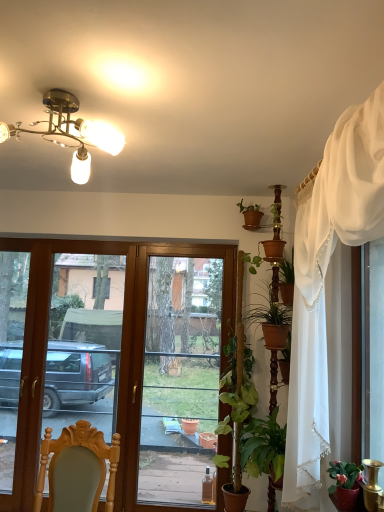
This screenshot has height=512, width=384. I want to click on matte brass chandelier at upper center, so pos(70,132).

Image resolution: width=384 pixels, height=512 pixels. Find the location of `wooden chair at lower left`. wooden chair at lower left is located at coordinates (77, 469).

Describe the element at coordinates (84, 342) in the screenshot. I see `brown wooden screen door at left` at that location.

In order to click on matte red pot at lower right, which is the 3th houseplant from left to right in this screenshot , I will do `click(345, 484)`.

In the image, is matte red pot at lower right, which is the 2th houseplant from top to bottom, positioned in front of or behind green leafy plant at center-right?

Clearly, matte red pot at lower right, which is the 2th houseplant from top to bottom, is in front of green leafy plant at center-right.

From a real-world perspective, is matte red pot at lower right, which is the 2th houseplant from top to bottom, positioned above or below green leafy plant at center-right?

From a real-world perspective, matte red pot at lower right, which is the 2th houseplant from top to bottom, is physically below green leafy plant at center-right.

From the image's perspective, is matte red pot at lower right, which is the 1th houseplant from front to back, under green leafy plant at center-right?

Yes.

Is point (342, 490) behind point (233, 360)?

No, it is not.

Is transparent glass door at center situated inside wooden chair at lower left or outside?

transparent glass door at center is not enclosed by wooden chair at lower left.

Looking at this image, considering the sizes of objects transparent glass door at center and wooden chair at lower left in the image provided, who is thinner, transparent glass door at center or wooden chair at lower left?

transparent glass door at center.

Which is closer to the camera, (159, 400) or (71, 475)?

Point (159, 400) is positioned farther from the camera compared to point (71, 475).

Is transparent glass door at center aimed at wooden chair at lower left?

Yes, transparent glass door at center is facing wooden chair at lower left.

From a real-world perspective, relative to green matte plant at right, acting as the second houseplant starting from the front, is wooden chair at lower left vertically above or below?

wooden chair at lower left is above green matte plant at right, acting as the second houseplant starting from the front.

Does wooden chair at lower left lie behind green matte plant at right, the 2th houseplant when ordered from back to front?

No, it is in front of green matte plant at right, the 2th houseplant when ordered from back to front.

Which is less distant, (x=49, y=467) or (x=222, y=425)?

Point (x=49, y=467) is positioned closer to the camera compared to point (x=222, y=425).

Does wooden chair at lower left have a smaller size compared to green matte plant at right, placed as the third houseplant when sorted from right to left?

Incorrect, wooden chair at lower left is not smaller in size than green matte plant at right, placed as the third houseplant when sorted from right to left.

From the image's perspective, is white sheer curtain at right under transparent glass door at center?

Incorrect, from the image's perspective, white sheer curtain at right is higher than transparent glass door at center.

Considering the positions of objects white sheer curtain at right and transparent glass door at center in the image provided, who is behind, white sheer curtain at right or transparent glass door at center?

transparent glass door at center is further from the camera.

Is transparent glass door at center surrounded by white sheer curtain at right?

No.

Is transparent glass door at center wider or thinner than matte red pot at lower right, which is the 3th houseplant from left to right?

transparent glass door at center is thinner than matte red pot at lower right, which is the 3th houseplant from left to right.

Who is smaller, transparent glass door at center or matte red pot at lower right, which is the 2th houseplant from top to bottom?

matte red pot at lower right, which is the 2th houseplant from top to bottom.

Is transparent glass door at center surrounding matte red pot at lower right, which is the 1th houseplant from front to back?

Definitely not — matte red pot at lower right, which is the 1th houseplant from front to back, is not inside transparent glass door at center.

Considering the positions of points (140, 483) and (362, 468), is point (140, 483) closer to camera compared to point (362, 468)?

No, (140, 483) is behind (362, 468).

Does green matte plant at right, the first houseplant positioned from the left, have a smaller size compared to brown wooden screen door at left?

Yes, green matte plant at right, the first houseplant positioned from the left, is smaller than brown wooden screen door at left.

From the image's perspective, would you say green matte plant at right, the first houseplant positioned from the left, is positioned over brown wooden screen door at left?

No, from the image's perspective, green matte plant at right, the first houseplant positioned from the left, is not above brown wooden screen door at left.

Considering the relative positions of green matte plant at right, acting as the second houseplant starting from the front, and brown wooden screen door at left in the image provided, is green matte plant at right, acting as the second houseplant starting from the front, in front of brown wooden screen door at left?

Yes.

Is green matte plant at right, acting as the second houseplant starting from the front, turned away from brown wooden screen door at left?

No, green matte plant at right, acting as the second houseplant starting from the front,'s orientation is not away from brown wooden screen door at left.

Who is shorter, green leafy plant at center-right or white sheer curtain at right?

green leafy plant at center-right is shorter.

Considering the positions of points (229, 348) and (291, 442), is point (229, 348) farther from camera compared to point (291, 442)?

Yes.

Considering the sizes of green leafy plant at center-right and white sheer curtain at right in the image, is green leafy plant at center-right bigger or smaller than white sheer curtain at right?

Clearly, green leafy plant at center-right is smaller in size than white sheer curtain at right.

Which is more to the right, green leafy plant at center-right or white sheer curtain at right?

white sheer curtain at right is more to the right.

In the image, there is a matte red pot at lower right, which is the 2th houseplant from top to bottom. At what (x,y) coordinates should I click in order to perform the action: click on plant above it (from the image's perspective). Please return your answer as a coordinate pair (x, y). The height and width of the screenshot is (512, 384). Looking at the image, I should click on (230, 361).

The width and height of the screenshot is (384, 512). Identify the location of window screen located on the right of wooden chair at lower left. (183, 377).

Estimate the real-world distances between objects in this image. Which object is closer to white sheer curtain at right, matte brass chandelier at upper center or transparent glass door at center?

matte brass chandelier at upper center is positioned closer to the anchor white sheer curtain at right.

From the image, which object appears to be nearer to white sheer curtain at right, green leafy plant at center-right or transparent glass door at center?

green leafy plant at center-right lies closer to white sheer curtain at right than the other object.

Which object lies nearer to the anchor point matte brass chandelier at upper center, matte brown pot at upper center, which is counted as the first houseplant, starting from the back, or brown wooden screen door at left?

Based on the image, matte brown pot at upper center, which is counted as the first houseplant, starting from the back, appears to be nearer to matte brass chandelier at upper center.

Based on their spatial positions, is wooden chair at lower left or matte brass chandelier at upper center closer to matte red pot at lower right, placed as the 3th houseplant when sorted from back to front?

wooden chair at lower left lies closer to matte red pot at lower right, placed as the 3th houseplant when sorted from back to front, than the other object.

Based on their spatial positions, is wooden chair at lower left or white sheer curtain at right closer to matte brown pot at upper center, acting as the third houseplant starting from the bottom?

The object closer to matte brown pot at upper center, acting as the third houseplant starting from the bottom, is white sheer curtain at right.

From the picture: When comparing their distances from matte red pot at lower right, which is the 3th houseplant from left to right, does wooden chair at lower left or transparent glass door at center seem further?

Based on the image, transparent glass door at center appears to be further to matte red pot at lower right, which is the 3th houseplant from left to right.

Consider the image. From the image, which object appears to be farther from wooden chair at lower left, matte red pot at lower right, which is the 1th houseplant from front to back, or matte brass chandelier at upper center?

matte brass chandelier at upper center.

Looking at the image, which one is located further to matte brass chandelier at upper center, wooden chair at lower left or matte brown pot at upper center, which appears as the second houseplant when viewed from the left?

Among the two, matte brown pot at upper center, which appears as the second houseplant when viewed from the left, is located further to matte brass chandelier at upper center.

At what (x,y) coordinates should I click in order to perform the action: click on plant positioned between white sheer curtain at right and brown wooden screen door at left from near to far. Please return your answer as a coordinate pair (x, y). Looking at the image, I should click on (230, 361).

Find the location of `screen door between matte brass chandelier at upper center and green matte plant at right, placed as the third houseplant when sorted from right to left, in the vertical direction`. screen door between matte brass chandelier at upper center and green matte plant at right, placed as the third houseplant when sorted from right to left, in the vertical direction is located at coordinates (84, 342).

In order to click on lamp located between white sheer curtain at right and matte brown pot at upper center, which appears as the second houseplant when viewed from the left, in the depth direction in this screenshot , I will do `click(70, 132)`.

Find the location of a particular element. This screenshot has height=512, width=384. lamp between white sheer curtain at right and transparent glass door at center along the z-axis is located at coordinates (70, 132).